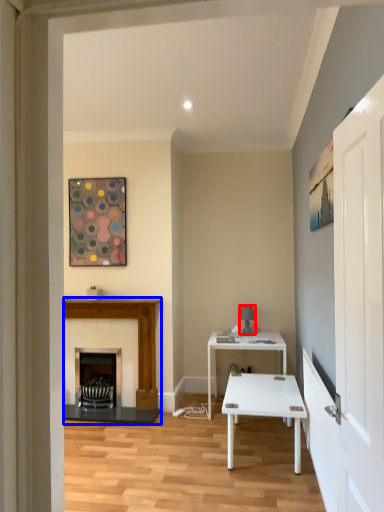
Question: Which object appears closest to the camera in this image, lamp (highlighted by a red box) or fireplace (highlighted by a blue box)?

Choices:
 (A) lamp
 (B) fireplace

Answer: (B)